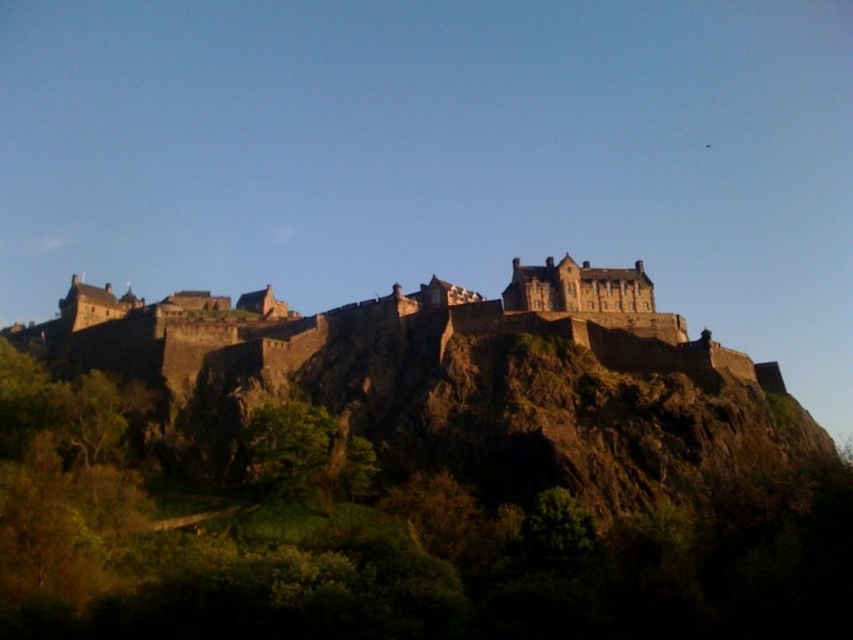
Find the location of `brown rocky hillside at center`. brown rocky hillside at center is located at coordinates (413, 481).